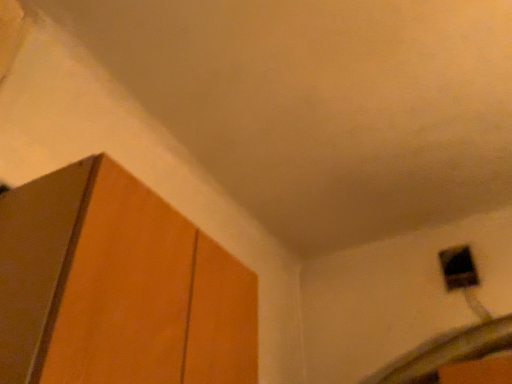
Question: Considering the positions of point (35, 321) and point (452, 269), is point (35, 321) closer or farther from the camera than point (452, 269)?

Choices:
 (A) farther
 (B) closer

Answer: (B)

Question: Considering their positions, is matte wood cabinet at left located in front of or behind black matte window at upper right?

Choices:
 (A) front
 (B) behind

Answer: (A)

Question: Considering the positions of matte wood cabinet at left and black matte window at upper right in the image, is matte wood cabinet at left taller or shorter than black matte window at upper right?

Choices:
 (A) tall
 (B) short

Answer: (A)

Question: From a real-world perspective, is black matte window at upper right positioned above or below matte wood cabinet at left?

Choices:
 (A) above
 (B) below

Answer: (A)

Question: Is black matte window at upper right inside the boundaries of matte wood cabinet at left, or outside?

Choices:
 (A) outside
 (B) inside

Answer: (A)

Question: In terms of height, does black matte window at upper right look taller or shorter compared to matte wood cabinet at left?

Choices:
 (A) tall
 (B) short

Answer: (B)

Question: From the image's perspective, is black matte window at upper right located above or below matte wood cabinet at left?

Choices:
 (A) above
 (B) below

Answer: (B)